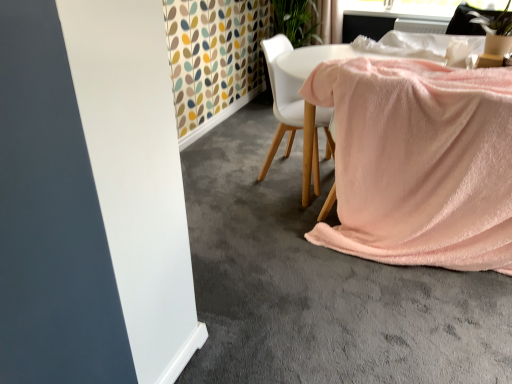
Where is `free space in front of white fabric chair at center`? The image size is (512, 384). free space in front of white fabric chair at center is located at coordinates (275, 210).